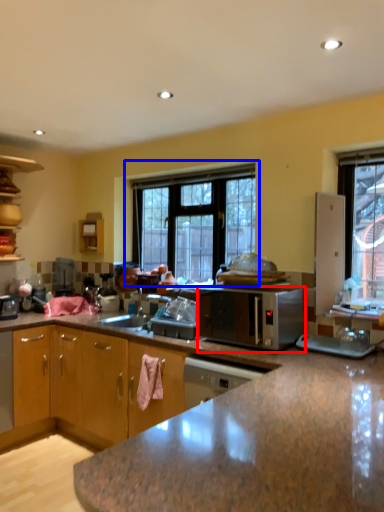
Question: Which of the following is the farthest to the observer, microwave oven (highlighted by a red box) or window (highlighted by a blue box)?

Choices:
 (A) microwave oven
 (B) window

Answer: (B)